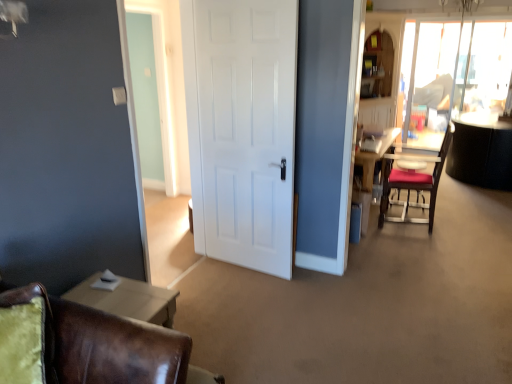
Question: Is white matte door at center wider than velvet brown swivel chair at lower left?

Choices:
 (A) no
 (B) yes

Answer: (A)

Question: Considering the relative sizes of white matte door at center and velvet brown swivel chair at lower left in the image provided, is white matte door at center bigger than velvet brown swivel chair at lower left?

Choices:
 (A) no
 (B) yes

Answer: (B)

Question: From the image's perspective, is white matte door at center over velvet brown swivel chair at lower left?

Choices:
 (A) no
 (B) yes

Answer: (B)

Question: Is white matte door at center taller than velvet brown swivel chair at lower left?

Choices:
 (A) no
 (B) yes

Answer: (B)

Question: Is white matte door at center next to velvet brown swivel chair at lower left?

Choices:
 (A) yes
 (B) no

Answer: (B)

Question: Would you say white matte door at center is outside velvet brown swivel chair at lower left?

Choices:
 (A) no
 (B) yes

Answer: (B)

Question: Is white matte door at center positioned in front of transparent glass window screen at upper right?

Choices:
 (A) no
 (B) yes

Answer: (B)

Question: Could you tell me if white matte door at center is turned towards transparent glass window screen at upper right?

Choices:
 (A) yes
 (B) no

Answer: (B)

Question: From a real-world perspective, is white matte door at center on top of transparent glass window screen at upper right?

Choices:
 (A) no
 (B) yes

Answer: (A)

Question: Is white matte door at center positioned beyond the bounds of transparent glass window screen at upper right?

Choices:
 (A) no
 (B) yes

Answer: (B)

Question: Considering the relative sizes of white matte door at center and transparent glass window screen at upper right in the image provided, is white matte door at center smaller than transparent glass window screen at upper right?

Choices:
 (A) no
 (B) yes

Answer: (B)

Question: Considering the relative positions of white matte door at center and transparent glass window screen at upper right in the image provided, is white matte door at center to the right of transparent glass window screen at upper right from the viewer's perspective?

Choices:
 (A) no
 (B) yes

Answer: (A)

Question: Does white matte door at center come behind velvet red chair at right, acting as the 1th chair starting from the back?

Choices:
 (A) yes
 (B) no

Answer: (B)